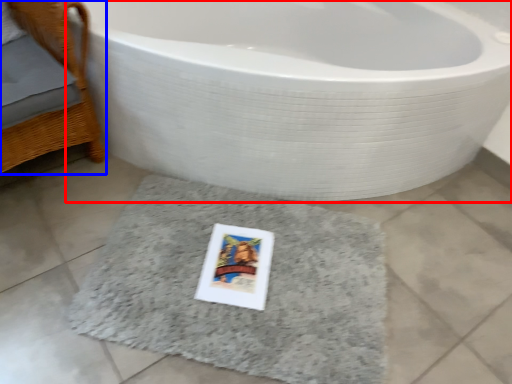
Question: Which point is closer to the camera, bathtub (highlighted by a red box) or furniture (highlighted by a blue box)?

Choices:
 (A) bathtub
 (B) furniture

Answer: (A)